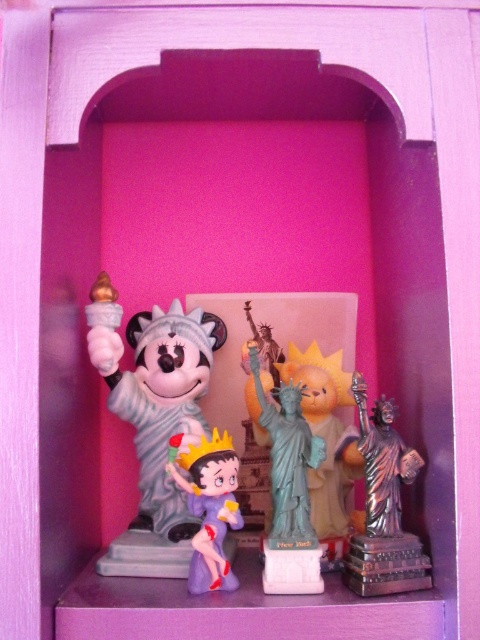
Which is above, matte gray statue at center or green matte statue of liberty at center?

matte gray statue at center is higher up.

Is point (199, 388) farther from camera compared to point (311, 577)?

That is True.

What do you see at coordinates (154, 419) in the screenshot? The height and width of the screenshot is (640, 480). I see `matte gray statue at center` at bounding box center [154, 419].

This screenshot has height=640, width=480. Identify the location of matte gray statue at center. (154, 419).

In order to click on matte plastic minnie mouse statue at center in this screenshot , I will do pos(332,474).

At what (x,y) coordinates should I click in order to perform the action: click on matte plastic minnie mouse statue at center. Please return your answer as a coordinate pair (x, y). Looking at the image, I should click on (332, 474).

I want to click on matte plastic minnie mouse statue at center, so click(332, 474).

Which is behind, point (134, 561) or point (380, 426)?

The point (134, 561) is more distant.

Can you confirm if matte gray statue at center is positioned below silver metallic statue at center?

Incorrect, matte gray statue at center is not positioned below silver metallic statue at center.

Identify the location of matte gray statue at center. The width and height of the screenshot is (480, 640). (154, 419).

This screenshot has height=640, width=480. I want to click on matte gray statue at center, so point(154,419).